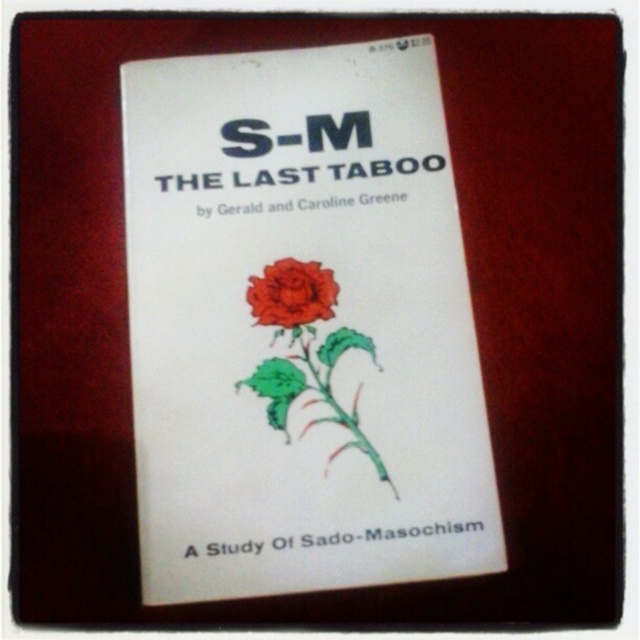
You are designing a display for a bookstore and need to place both the white paper book at center and the matte red rose at center on a shelf. Given that the shelf has limited space, which object should you prioritize placing first to ensure both fit?

The white paper book at center is larger than the matte red rose at center, so you should place the white paper book at center first to ensure both fit on the shelf.

What are the coordinates of the white paper book at center?

The white paper book at center is located at coordinates point (300, 326).

You are an artist who wants to sketch the book cover. You need to know the relative positions of the white paper book at center and the matte red rose at center. Can you tell me which one is placed higher on the cover?

The matte red rose at center is placed higher than the white paper book at center because the white paper book at center is positioned under the matte red rose at center.